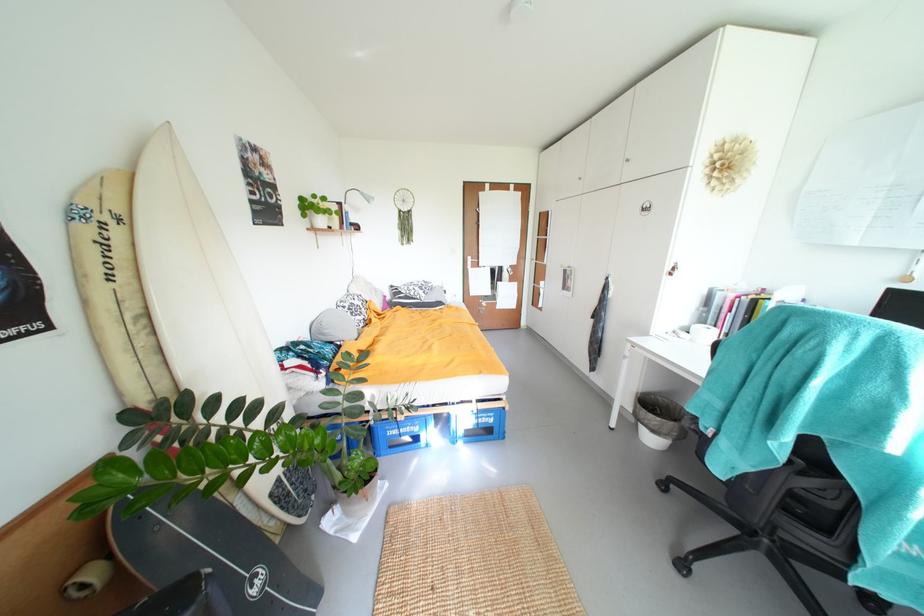
Image resolution: width=924 pixels, height=616 pixels. Identify the location of small trash can. (659, 419).